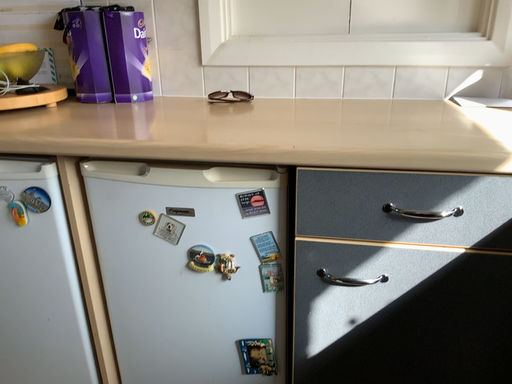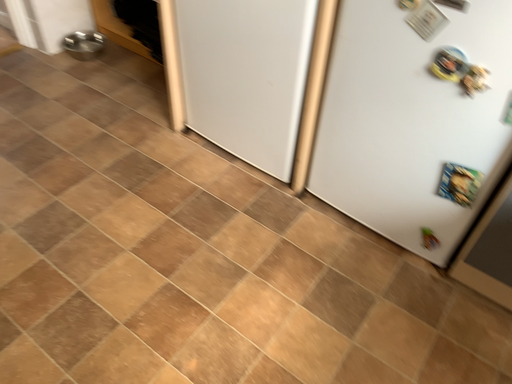
Question: How did the camera likely rotate when shooting the video?

Choices:
 (A) rotated left
 (B) rotated right

Answer: (A)